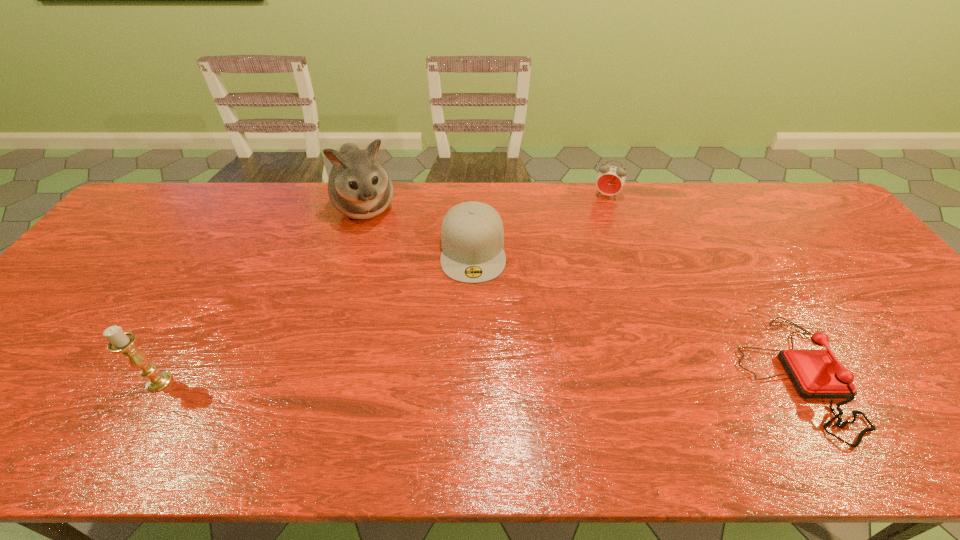
What are the coordinates of `vacant region between the shortest object and the alarm clock` in the screenshot? It's located at (701, 287).

The height and width of the screenshot is (540, 960). What are the coordinates of `free spot between the fourth object from right to left and the alarm clock` in the screenshot? It's located at (487, 201).

Locate which object ranks fourth in proximity to the second object from right to left. Please provide its 2D coordinates. Your answer should be formatted as a tuple, i.e. [(x, y)], where the tuple contains the x and y coordinates of a point satisfying the conditions above.

[(122, 342)]

Locate which object is the third closest to the shortest object. Please provide its 2D coordinates. Your answer should be formatted as a tuple, i.e. [(x, y)], where the tuple contains the x and y coordinates of a point satisfying the conditions above.

[(359, 187)]